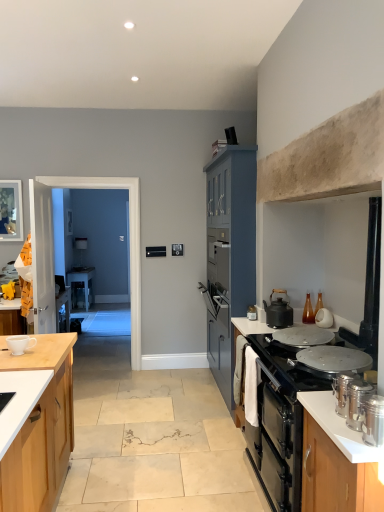
Find the location of a particular element. This screenshot has width=384, height=512. vacant point to the left of satin silver canisters at right, the 2th kitchen appliance when ordered from front to back is located at coordinates (322, 414).